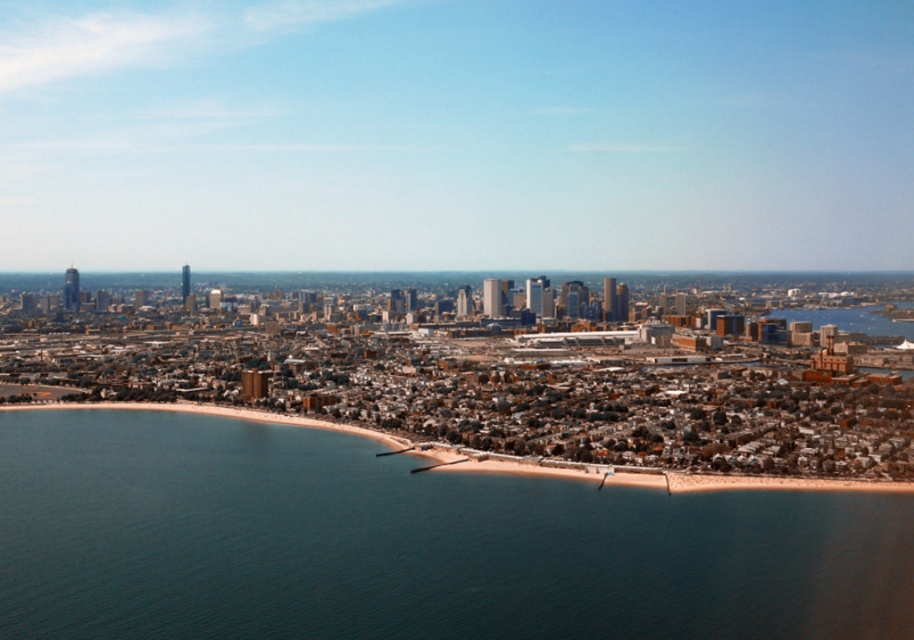
Is blue water at lower left thinner than smooth sand beach at lower center?

Yes, blue water at lower left is thinner than smooth sand beach at lower center.

Identify the location of blue water at lower left. (409, 544).